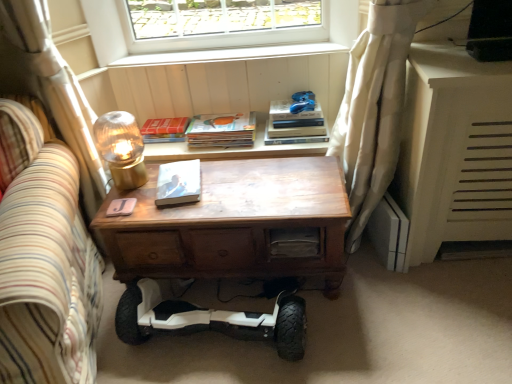
At what (x,y) coordinates should I click in order to perform the action: click on vacant space that's between hardcover book at upper center, placed as the 1th paperback book when sorted from top to bottom, and matte paper book at center, positioned as the second paperback book in front-to-back order. Please return your answer as a coordinate pair (x, y). The height and width of the screenshot is (384, 512). Looking at the image, I should click on (167, 145).